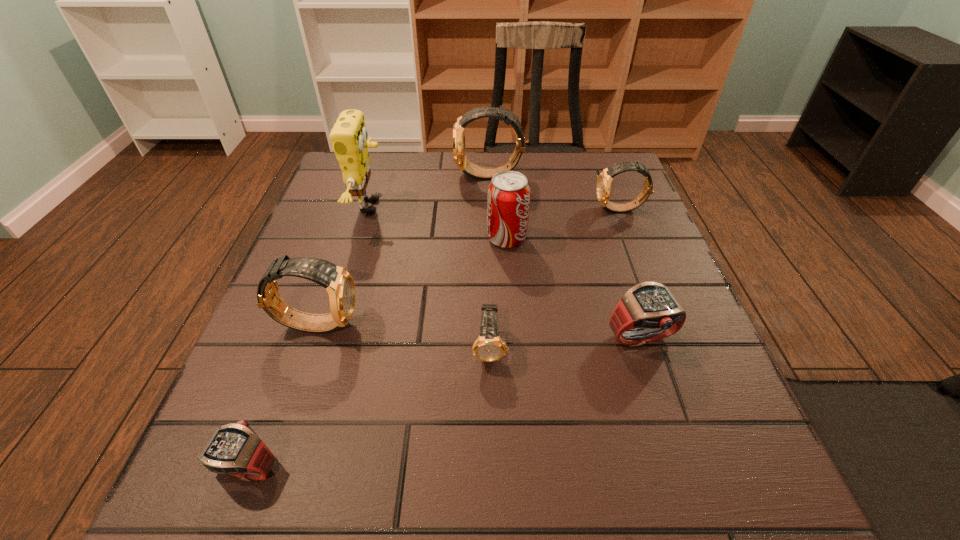
Where is `unoccupied position between the second farthest gold watch and the tallest watch`? The image size is (960, 540). unoccupied position between the second farthest gold watch and the tallest watch is located at coordinates (555, 192).

The image size is (960, 540). Identify the location of unoccupied area between the biggest gold watch and the smallest gold watch. (490, 261).

Identify the location of empty space between the tallest watch and the tallest object. The height and width of the screenshot is (540, 960). (430, 191).

You are a GUI agent. You are given a task and a screenshot of the screen. Output one action in this format:
    pyautogui.click(x=<x>, y=<y>)
    Task: Click on the free space between the smallest gold watch and the shortest object
    The image size is (960, 540).
    Given the screenshot: What is the action you would take?
    pyautogui.click(x=369, y=407)

I want to click on vacant space that is in between the tallest object and the soda, so click(439, 222).

The width and height of the screenshot is (960, 540). I want to click on free space between the third smallest gold watch and the fifth nearest watch, so click(468, 266).

The height and width of the screenshot is (540, 960). Find the location of `the second closest object to the fifth tallest object`. the second closest object to the fifth tallest object is located at coordinates (508, 202).

Identify which object is located as the seventh nearest to the second farthest watch. Please provide its 2D coordinates. Your answer should be formatted as a tuple, i.e. [(x, y)], where the tuple contains the x and y coordinates of a point satisfying the conditions above.

[(235, 449)]

The image size is (960, 540). I want to click on watch identified as the second closest to the smallest gold watch, so click(339, 284).

Identify which watch is located as the fourth nearest to the smallest gold watch. Please provide its 2D coordinates. Your answer should be formatted as a tuple, i.e. [(x, y)], where the tuple contains the x and y coordinates of a point satisfying the conditions above.

[(604, 181)]